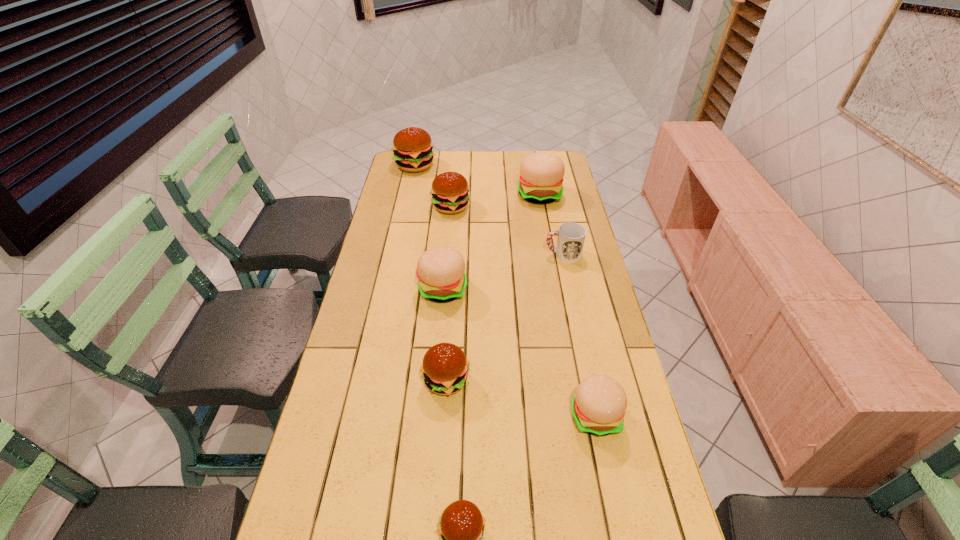
Where is `the leftmost brown hamburger`? the leftmost brown hamburger is located at coordinates (412, 147).

The image size is (960, 540). I want to click on the biggest brown hamburger, so click(x=412, y=147).

At what (x,y) coordinates should I click in order to perform the action: click on the farthest beige hamburger. Please return your answer as a coordinate pair (x, y). This screenshot has width=960, height=540. Looking at the image, I should click on tap(541, 174).

Find the location of `the third nearest brown hamburger`. the third nearest brown hamburger is located at coordinates (449, 191).

At what (x,y) coordinates should I click in order to perform the action: click on the second biggest beige hamburger. Please return your answer as a coordinate pair (x, y). Looking at the image, I should click on (441, 270).

At what (x,y) coordinates should I click in order to perform the action: click on the fifth farthest object. Please return your answer as a coordinate pair (x, y). Looking at the image, I should click on (441, 270).

Identify the location of the third farthest brown hamburger. (445, 368).

Identify the location of the smallest beige hamburger. The width and height of the screenshot is (960, 540). (598, 406).

Where is `the fifth nearest object`? This screenshot has width=960, height=540. the fifth nearest object is located at coordinates (571, 236).

Image resolution: width=960 pixels, height=540 pixels. I want to click on cup, so click(571, 236).